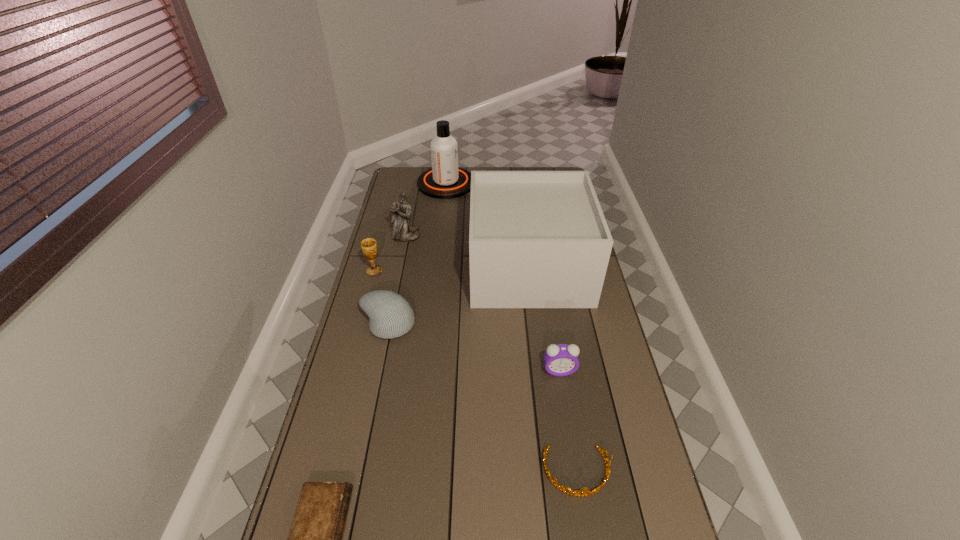
You are a GUI agent. You are given a task and a screenshot of the screen. Output one action in this format:
    pyautogui.click(x=<x>, y=<y>)
    Task: Click on the blank region between the beanie and the cleansing agent
    This screenshot has height=540, width=960.
    Given the screenshot: What is the action you would take?
    pyautogui.click(x=417, y=254)

At what (x,y) coordinates should I click in order to perform the action: click on free space between the chalice and the alarm clock. Please return your answer as a coordinate pair (x, y). The width and height of the screenshot is (960, 540). Looking at the image, I should click on (467, 321).

You are a GUI agent. You are given a task and a screenshot of the screen. Output one action in this format:
    pyautogui.click(x=<x>, y=<y>)
    Task: Click on the unoccupied area between the tiara and the third nearest object
    The image size is (960, 540).
    Given the screenshot: What is the action you would take?
    coord(568,421)

This screenshot has height=540, width=960. What are the coordinates of `unoccupied area between the sixth farthest object and the second shortest object` in the screenshot? It's located at (568, 421).

Locate an element on the screen. free space between the beanie and the second shortest object is located at coordinates (482, 398).

The image size is (960, 540). What are the coordinates of `object that ranks as the sixth closest to the chalice` in the screenshot? It's located at (315, 539).

Find the location of a particular element. object that stands as the sixth closest to the box is located at coordinates pyautogui.click(x=578, y=493).